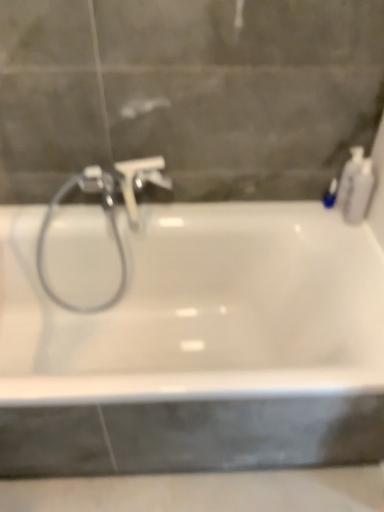
Question: Is white plastic bottle at right, which appears as the first toiletry when viewed from the right, wider or thinner than white glossy bathtub at center?

Choices:
 (A) thin
 (B) wide

Answer: (A)

Question: Is white plastic bottle at right, which appears as the first toiletry when viewed from the right, inside the boundaries of white glossy bathtub at center, or outside?

Choices:
 (A) inside
 (B) outside

Answer: (B)

Question: Considering the real-world distances, which object is farthest from the white plastic soap dispenser at upper right, marked as the 2th toiletry in a left-to-right arrangement?

Choices:
 (A) white plastic bottle at right, the 3th toiletry positioned from the left
 (B) satin nickel faucet at center
 (C) white glossy bathtub at center
 (D) satin nickel faucet at upper left
 (E) blue glossy bottle at upper right, the 3th toiletry from the right

Answer: (D)

Question: Based on their relative distances, which object is nearer to the white plastic soap dispenser at upper right, the 2th toiletry in the right-to-left sequence?

Choices:
 (A) white plastic bottle at right, which appears as the first toiletry when viewed from the right
 (B) satin nickel faucet at upper left
 (C) satin nickel faucet at center
 (D) white glossy bathtub at center
 (E) blue glossy bottle at upper right, which ranks as the first toiletry in left-to-right order

Answer: (A)